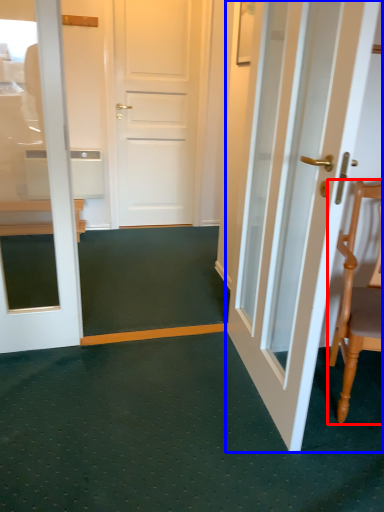
Question: Which object is further to the camera taking this photo, chair (highlighted by a red box) or door (highlighted by a blue box)?

Choices:
 (A) chair
 (B) door

Answer: (A)